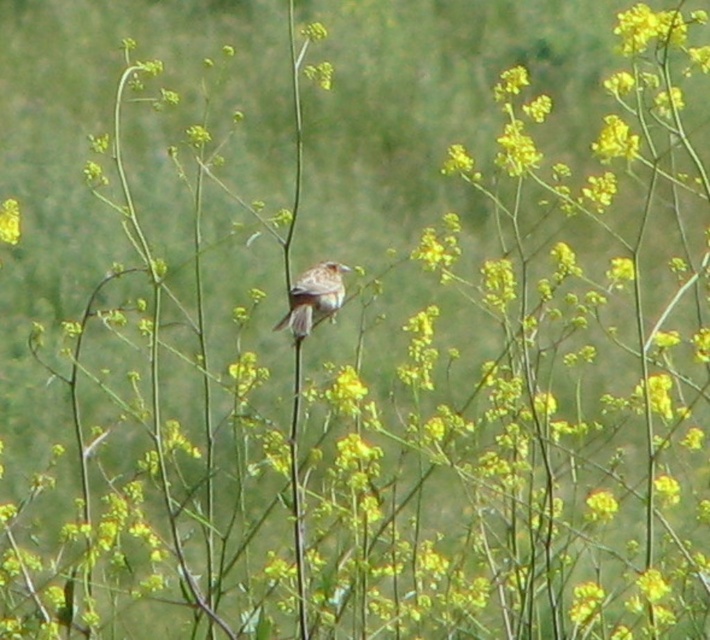
Is brown feathered bird at center bigger than yellow matte flower at center?

Indeed, brown feathered bird at center has a larger size compared to yellow matte flower at center.

Can you confirm if brown feathered bird at center is wider than yellow matte flower at center?

Correct, the width of brown feathered bird at center exceeds that of yellow matte flower at center.

You are a GUI agent. You are given a task and a screenshot of the screen. Output one action in this format:
    pyautogui.click(x=<x>, y=<y>)
    Task: Click on the brown feathered bird at center
    Image resolution: width=710 pixels, height=640 pixels.
    Given the screenshot: What is the action you would take?
    pyautogui.click(x=312, y=298)